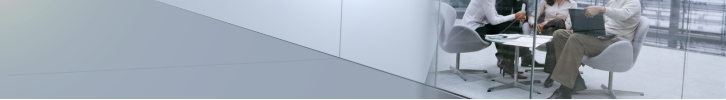
You are a GUI agent. You are given a task and a screenshot of the screen. Output one action in this format:
    pyautogui.click(x=<x>, y=<y>)
    Task: Click on the laptop computer
    Image resolution: width=726 pixels, height=100 pixels.
    Given the screenshot: What is the action you would take?
    pyautogui.click(x=584, y=28)